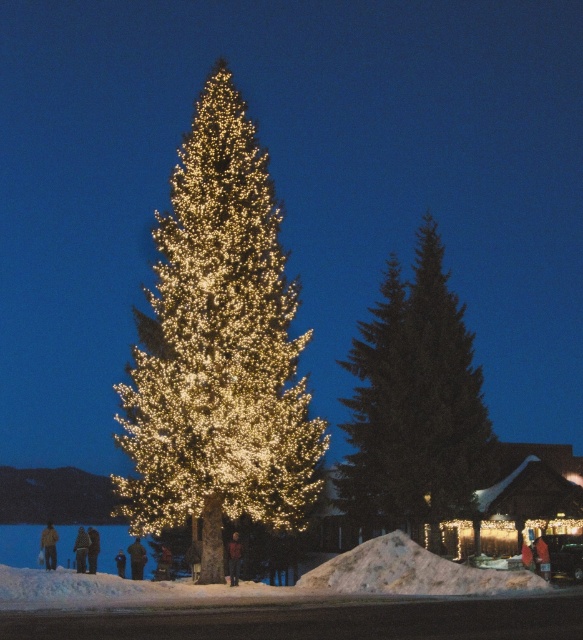
Question: Considering the relative positions of dark brown leather jacket at lower center and black fabric person at lower left in the image provided, where is dark brown leather jacket at lower center located with respect to black fabric person at lower left?

Choices:
 (A) below
 (B) above

Answer: (B)

Question: Which is nearer to the white snow at lower center?

Choices:
 (A) dark brown fur coat at lower center
 (B) brown fuzzy coat at lower left

Answer: (A)

Question: Which object appears farthest from the camera in this image?

Choices:
 (A) illuminated gold christmas tree at center
 (B) dark brown fur coat at lower center

Answer: (A)

Question: Does brown leather jacket at center have a larger size compared to black fabric person at lower left?

Choices:
 (A) yes
 (B) no

Answer: (B)

Question: Among these points, which one is farthest from the camera?

Choices:
 (A) (238, 544)
 (B) (115, 564)
 (C) (54, 563)
 (D) (514, 573)

Answer: (B)

Question: Can you confirm if brown fuzzy coat at lower left is positioned to the right of dark brown fur coat at lower center?

Choices:
 (A) yes
 (B) no

Answer: (B)